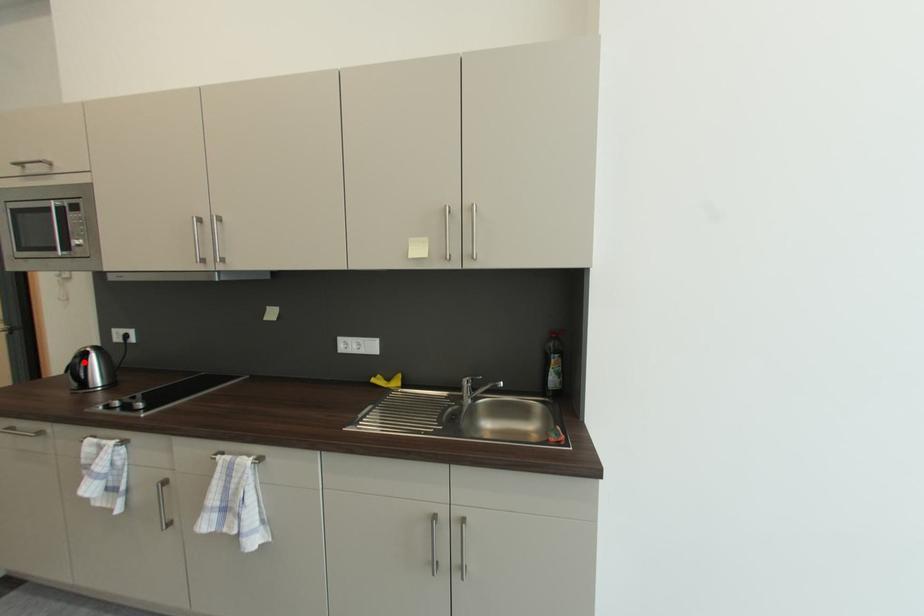
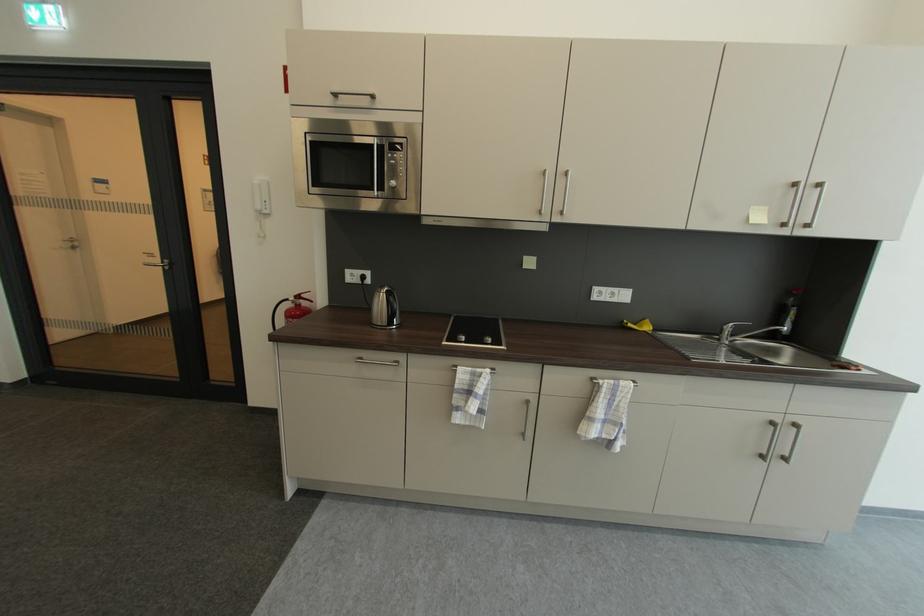
The point at the highlighted location is marked in the first image. Where is the corresponding point in the second image?

(397, 301)